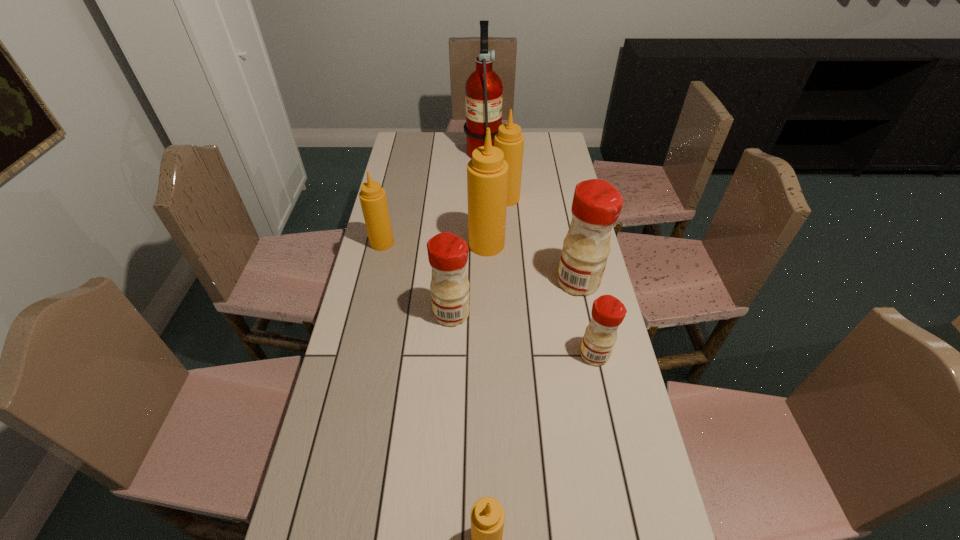
Locate an element on the screen. This screenshot has width=960, height=540. condiment object that ranks as the fifth closest to the second tallest object is located at coordinates (608, 312).

The height and width of the screenshot is (540, 960). In order to click on condiment object that ranks as the sixth closest to the sixth farthest object in this screenshot , I will do `click(487, 514)`.

The width and height of the screenshot is (960, 540). Find the location of `the second closest tan condiment relative to the biggest tan condiment`. the second closest tan condiment relative to the biggest tan condiment is located at coordinates (372, 196).

The image size is (960, 540). Identify the location of tan condiment that stands as the third closest to the biggest tan condiment. (487, 514).

You are a GUI agent. You are given a task and a screenshot of the screen. Output one action in this format:
    pyautogui.click(x=<x>, y=<y>)
    Task: Click on the red condiment identified as the second closest to the second biggest tan condiment
    The image size is (960, 540).
    Given the screenshot: What is the action you would take?
    tap(448, 253)

Identify which red condiment is located as the nearest to the fourth nearest object. Please provide its 2D coordinates. Your answer should be formatted as a tuple, i.e. [(x, y)], where the tuple contains the x and y coordinates of a point satisfying the conditions above.

[(608, 312)]

The width and height of the screenshot is (960, 540). Find the location of `free location that satisfies the following two spatial constraints: 1. on the nozzle and handle of the smallest red condiment; 2. on the right side of the farthest object`. free location that satisfies the following two spatial constraints: 1. on the nozzle and handle of the smallest red condiment; 2. on the right side of the farthest object is located at coordinates (486, 354).